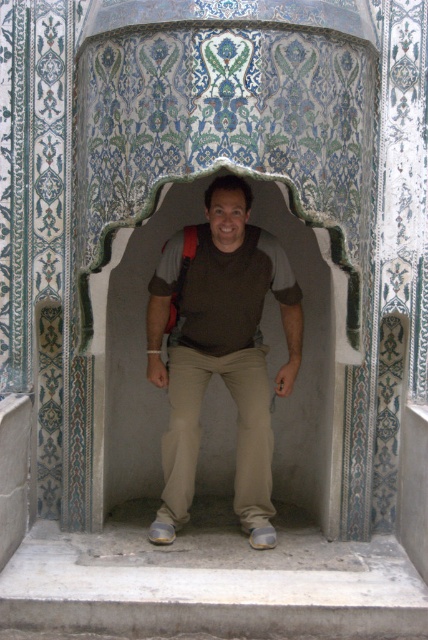
You are standing in the alcove and want to exit to the lower area. Where are the gray concrete stairs at lower center located in relation to your current position?

The gray concrete stairs at lower center are located at point (x=211, y=582) in 2D space, so they are directly in front of you at the lower center of the alcove.

You are a tour guide explaining the architectural features of the alcove to visitors. You notice the gray concrete stairs at lower center and the brown matte shirt at center. Which object is wider when viewed from your perspective?

The gray concrete stairs at lower center is wider than the brown matte shirt at center.